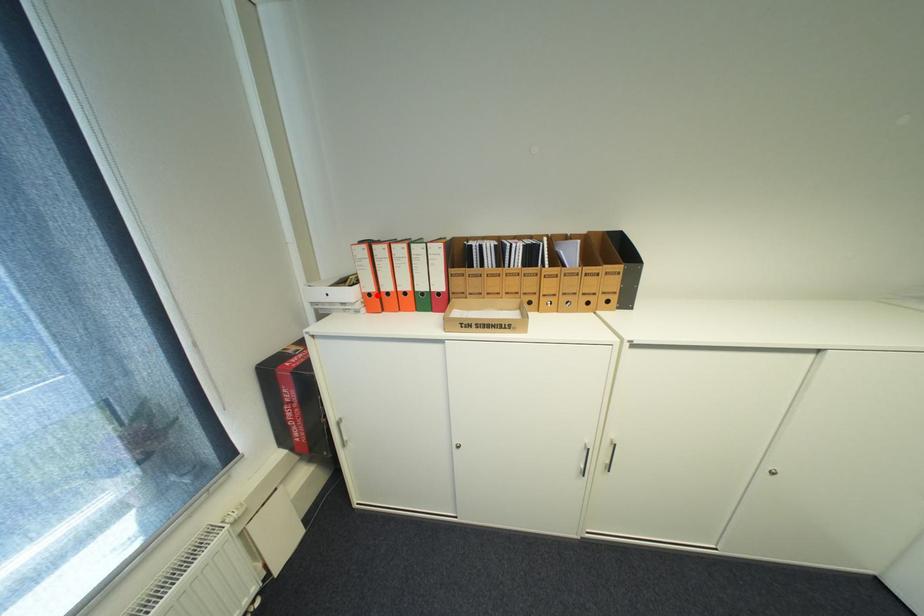
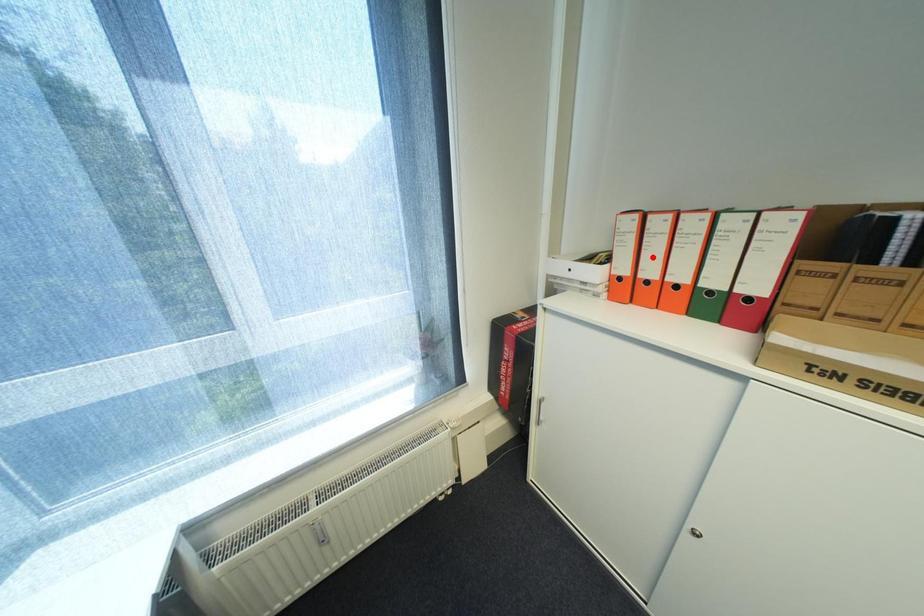
I am providing you with two images of the same scene from different viewpoints. A red point is marked on the first image and another point is marked on the second image. Is the red point in image1 aligned with the point shown in image2?

No